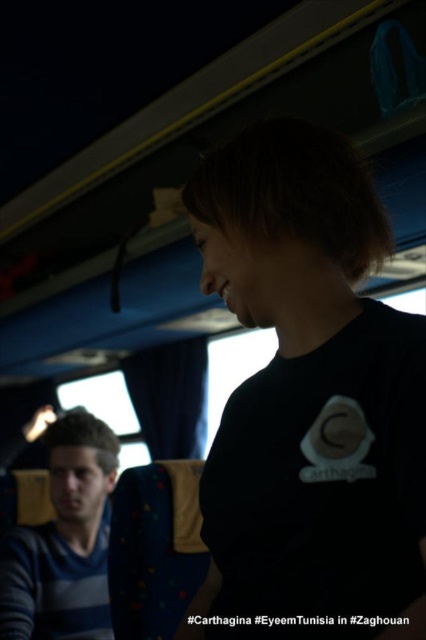
Looking at this image, you are a passenger on a bus and want to know if you can safely reach the overhead compartment without disturbing the person in the black matte shirt at center. The overhead compartment is 24 inches away from the seat. Can you reach it?

A: The distance between you and the black matte shirt at center is 19.92 inches. Since the overhead compartment is 24 inches away from the seat, you can reach it without disturbing them as there is enough space.

You are a photographer trying to capture a candid shot of both the black matte shirt at center and the blue striped shirt at lower left in this vehicle scene. Considering their sizes in the frame, which one might be easier to include fully in your photo without cropping?

The blue striped shirt at lower left is larger in the frame since it occupies more space than the black matte shirt at center. Therefore, it would be easier to include the blue striped shirt at lower left fully without cropping, while the smaller black matte shirt at center might require adjusting the shot to fit both.

You are a photographer trying to capture both the black matte shirt at center and the blue striped shirt at lower left in a single shot. Based on their positions, which shirt should you focus on first to ensure both are in focus?

The black matte shirt at center is closer to the viewer than the blue striped shirt at lower left. To ensure both are in focus, you should focus on the black matte shirt at center first since it is closer, and the blue striped shirt at lower left will naturally be in focus as it is further away.